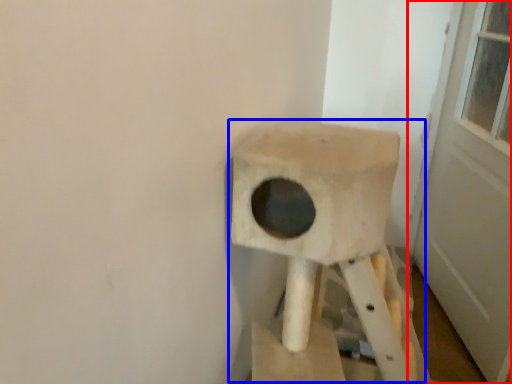
Question: Among these objects, which one is nearest to the camera, door (highlighted by a red box) or swivel chair (highlighted by a blue box)?

Choices:
 (A) door
 (B) swivel chair

Answer: (B)